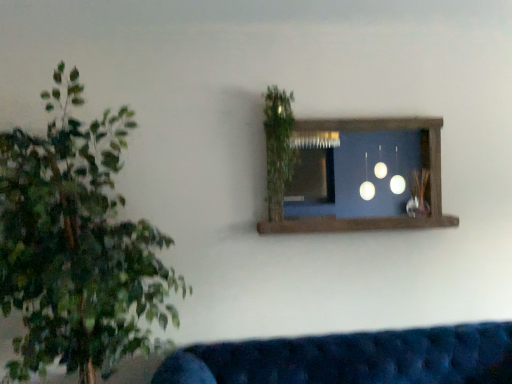
Question: Can we say velvet blue couch at lower center lies outside brown wooden window frame at upper center?

Choices:
 (A) yes
 (B) no

Answer: (A)

Question: Is velvet blue couch at lower center facing towards brown wooden window frame at upper center?

Choices:
 (A) yes
 (B) no

Answer: (B)

Question: Considering the relative positions of velvet blue couch at lower center and brown wooden window frame at upper center in the image provided, is velvet blue couch at lower center in front of brown wooden window frame at upper center?

Choices:
 (A) no
 (B) yes

Answer: (B)

Question: Does velvet blue couch at lower center appear on the right side of brown wooden window frame at upper center?

Choices:
 (A) no
 (B) yes

Answer: (B)

Question: Is brown wooden window frame at upper center completely or partially inside velvet blue couch at lower center?

Choices:
 (A) yes
 (B) no

Answer: (B)

Question: Considering the positions of brown wooden window frame at upper center and green leafy plant at upper center in the image, is brown wooden window frame at upper center wider or thinner than green leafy plant at upper center?

Choices:
 (A) wide
 (B) thin

Answer: (B)

Question: Do you think brown wooden window frame at upper center is within green leafy plant at upper center, or outside of it?

Choices:
 (A) outside
 (B) inside

Answer: (A)

Question: In terms of size, does brown wooden window frame at upper center appear bigger or smaller than green leafy plant at upper center?

Choices:
 (A) small
 (B) big

Answer: (B)

Question: Relative to green leafy plant at upper center, is brown wooden window frame at upper center in front or behind?

Choices:
 (A) front
 (B) behind

Answer: (B)

Question: Relative to brown wooden window frame at upper center, is green leafy plant at upper center in front or behind?

Choices:
 (A) behind
 (B) front

Answer: (B)

Question: From the image's perspective, relative to brown wooden window frame at upper center, is green leafy plant at upper center above or below?

Choices:
 (A) below
 (B) above

Answer: (B)

Question: From a real-world perspective, relative to brown wooden window frame at upper center, is green leafy plant at upper center vertically above or below?

Choices:
 (A) below
 (B) above

Answer: (B)

Question: Is green leafy plant at upper center to the left or to the right of brown wooden window frame at upper center in the image?

Choices:
 (A) left
 (B) right

Answer: (A)

Question: Looking at their shapes, would you say velvet blue couch at lower center is wider or thinner than green leafy plant at upper center?

Choices:
 (A) thin
 (B) wide

Answer: (B)

Question: Considering the relative positions of velvet blue couch at lower center and green leafy plant at upper center in the image provided, is velvet blue couch at lower center to the left or to the right of green leafy plant at upper center?

Choices:
 (A) right
 (B) left

Answer: (A)